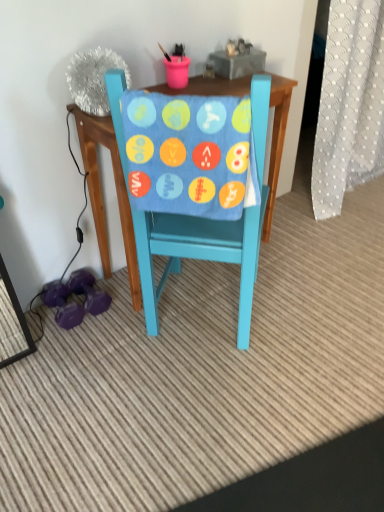
Question: Which is correct: white dotted fabric at right is inside blue soft fabric at center, or outside of it?

Choices:
 (A) inside
 (B) outside

Answer: (B)

Question: Visually, is white dotted fabric at right positioned to the left or to the right of blue soft fabric at center?

Choices:
 (A) right
 (B) left

Answer: (A)

Question: Which is farther from the white dotted fabric at right?

Choices:
 (A) blue soft fabric at center
 (B) teal painted wood chair at center

Answer: (A)

Question: Based on their relative distances, which object is farther from the white dotted fabric at right?

Choices:
 (A) blue soft fabric at center
 (B) teal painted wood chair at center

Answer: (A)